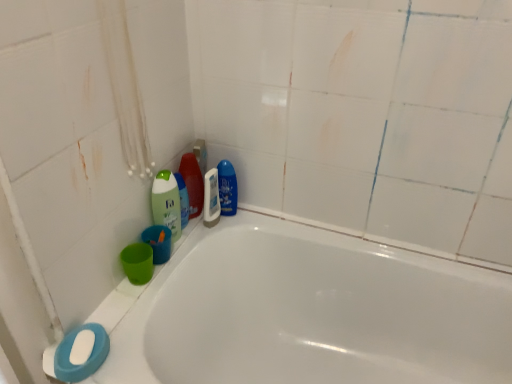
You are a GUI agent. You are given a task and a screenshot of the screen. Output one action in this format:
    pyautogui.click(x=<x>, y=<y>)
    Task: Click on the vacant space that is in between blue glossy bottle at upper center, the 1th cleaning product from the right, and white matte soap at lower left
    Image resolution: width=512 pixels, height=384 pixels.
    Given the screenshot: What is the action you would take?
    pyautogui.click(x=169, y=274)